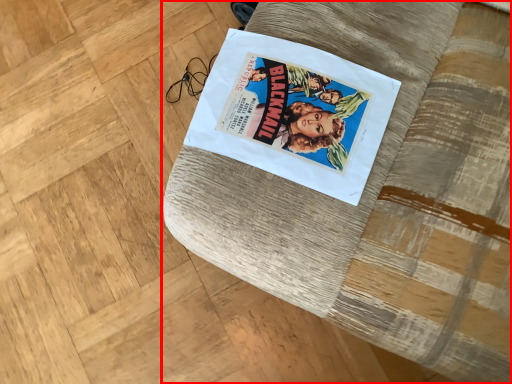
Question: In this image, where is furniture (annotated by the red box) located relative to paperback book?

Choices:
 (A) right
 (B) left

Answer: (A)